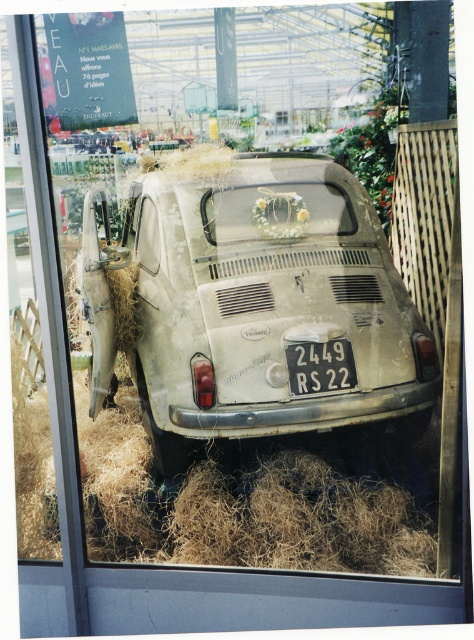
You are a photographer positioned to the right of the dirty white car at center and the white plastic license plate at center. You want to capture a photo where both objects are visible in the frame. Which object should you position closer to the left side of the camera frame?

The dirty white car at center is to the left of the white plastic license plate at center, so you should position the dirty white car at center closer to the left side of the camera frame to include both in the shot.

You are a photographer trying to capture a clear shot of the white plastic license plate at center without the dirty white car at center blocking it. Is this possible given their current positions?

The dirty white car at center is positioned over the white plastic license plate at center, so it is blocking it completely. Therefore, you cannot capture a clear shot of the license plate without moving the car.

Based on the scene description, where is the dirty white car at center located in terms of coordinates?

The dirty white car at center is located at point coordinates of (247, 300).